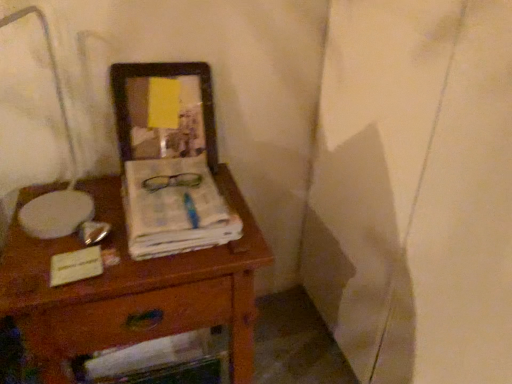
Question: Is wooden desk at center at the back of white paper at center?

Choices:
 (A) no
 (B) yes

Answer: (A)

Question: Is white paper at center shorter than wooden desk at center?

Choices:
 (A) yes
 (B) no

Answer: (A)

Question: Can you confirm if white paper at center is positioned to the right of wooden desk at center?

Choices:
 (A) no
 (B) yes

Answer: (B)

Question: From the image's perspective, is white paper at center located beneath wooden desk at center?

Choices:
 (A) yes
 (B) no

Answer: (B)

Question: Is white paper at center smaller than wooden desk at center?

Choices:
 (A) yes
 (B) no

Answer: (A)

Question: In terms of width, does wooden drawer at lower center look wider or thinner when compared to wooden desk at center?

Choices:
 (A) wide
 (B) thin

Answer: (B)

Question: Visually, is wooden drawer at lower center positioned to the left or to the right of wooden desk at center?

Choices:
 (A) left
 (B) right

Answer: (B)

Question: Is wooden drawer at lower center spatially inside wooden desk at center, or outside of it?

Choices:
 (A) outside
 (B) inside

Answer: (B)

Question: Considering the positions of wooden drawer at lower center and wooden desk at center in the image, is wooden drawer at lower center bigger or smaller than wooden desk at center?

Choices:
 (A) big
 (B) small

Answer: (B)

Question: Is point [199, 69] closer or farther from the camera than point [104, 334]?

Choices:
 (A) closer
 (B) farther

Answer: (B)

Question: In terms of size, does wooden picture frame at upper center appear bigger or smaller than wooden drawer at lower center?

Choices:
 (A) big
 (B) small

Answer: (B)

Question: Is wooden picture frame at upper center situated inside wooden drawer at lower center or outside?

Choices:
 (A) outside
 (B) inside

Answer: (A)

Question: From a real-world perspective, is wooden picture frame at upper center above or below wooden drawer at lower center?

Choices:
 (A) above
 (B) below

Answer: (A)

Question: From the image's perspective, is wooden picture frame at upper center positioned above or below white paper at center?

Choices:
 (A) below
 (B) above

Answer: (B)

Question: Visually, is wooden picture frame at upper center positioned to the left or to the right of white paper at center?

Choices:
 (A) right
 (B) left

Answer: (B)